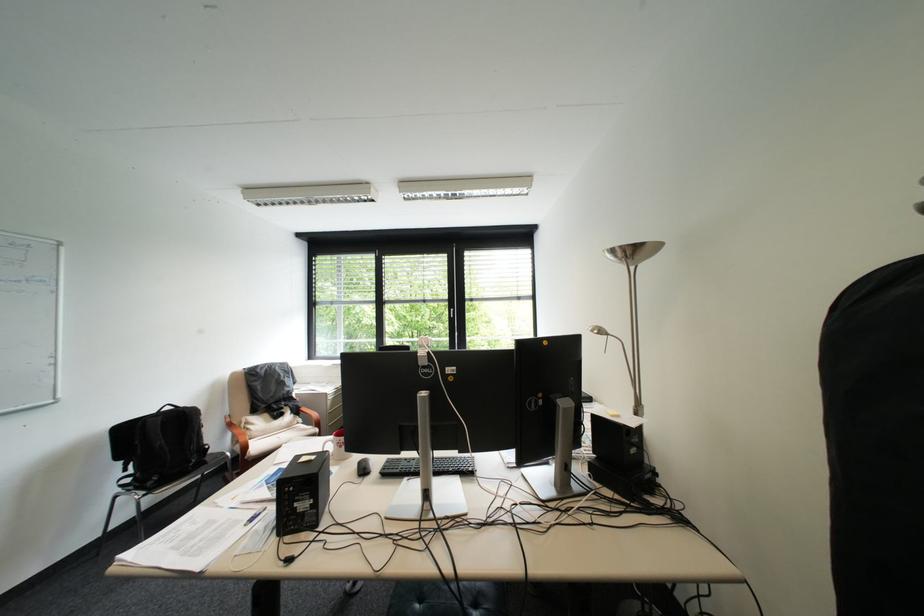
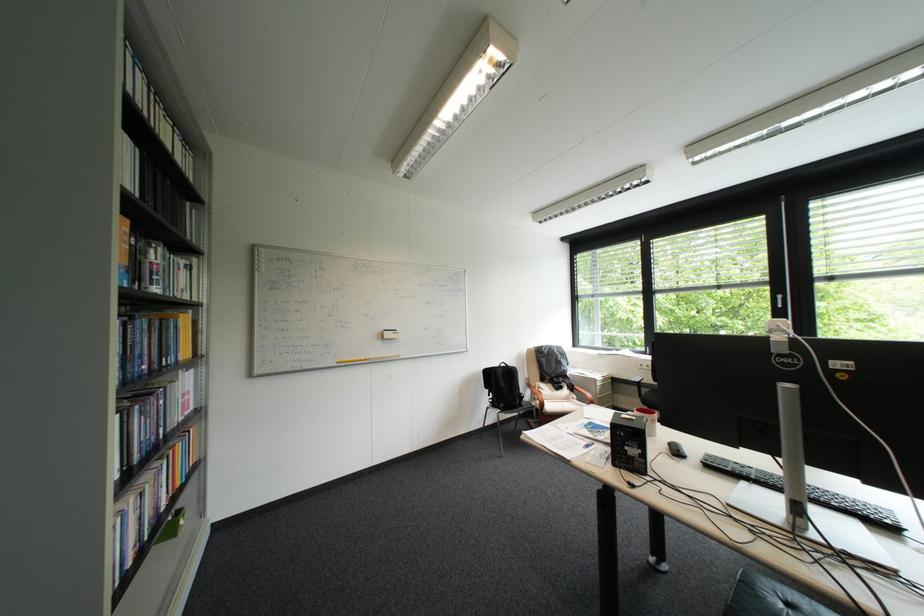
In the second image, find the point that corresponds to the point at 348,435 in the first image.

(650, 411)